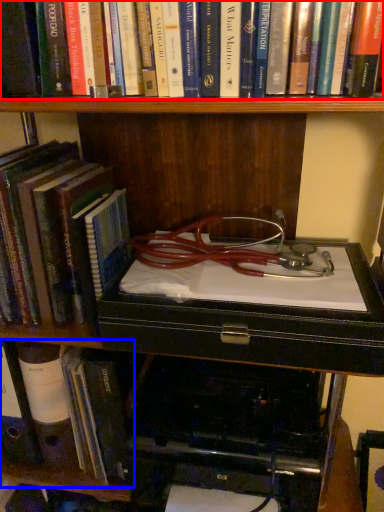
Question: Which of the following is the closest to the observer, book (highlighted by a red box) or book (highlighted by a blue box)?

Choices:
 (A) book
 (B) book

Answer: (A)